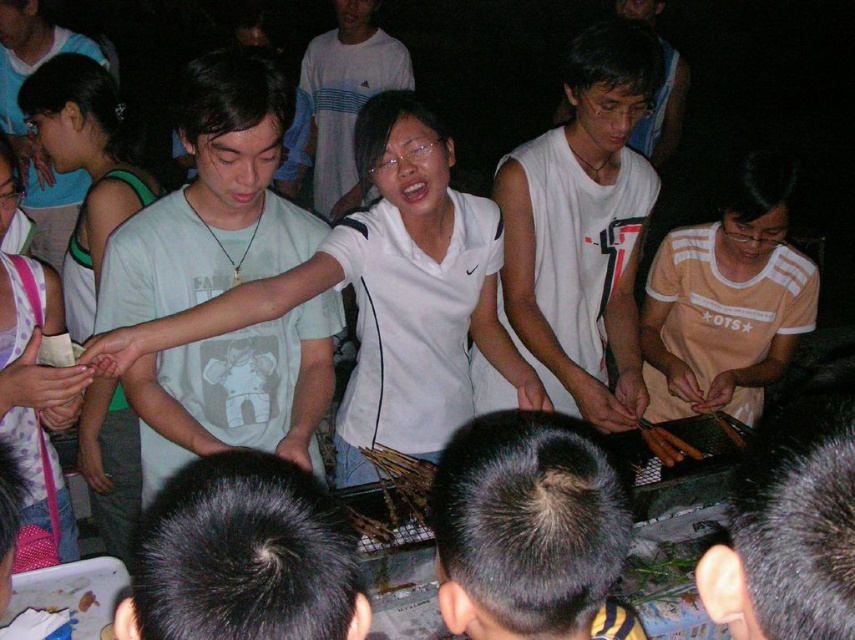
Which is below, white jersey at center or white cotton shirt at upper left?

white jersey at center is below.

Can you confirm if white jersey at center is positioned above white cotton shirt at upper left?

No.

Is point (553, 179) less distant than point (19, 20)?

Yes.

Identify the location of white jersey at center. tap(582, 228).

Which is below, light gray t-shirt at center or brown crispy chicken at center?

Positioned lower is brown crispy chicken at center.

Can you confirm if light gray t-shirt at center is bigger than brown crispy chicken at center?

Correct, light gray t-shirt at center is larger in size than brown crispy chicken at center.

Does point (198, 120) come closer to viewer compared to point (87, 596)?

That is True.

At what (x,y) coordinates should I click in order to perform the action: click on light gray t-shirt at center. Please return your answer as a coordinate pair (x, y). This screenshot has width=855, height=640. Looking at the image, I should click on (211, 200).

Is white matte shirt at center behind brown crispy chicken at center?

Yes, it is behind brown crispy chicken at center.

Does white matte shirt at center have a smaller size compared to brown crispy chicken at center?

Actually, white matte shirt at center might be larger than brown crispy chicken at center.

Is point (369, 74) positioned in front of point (80, 604)?

That is False.

The image size is (855, 640). Identify the location of white matte shirt at center. (346, 97).